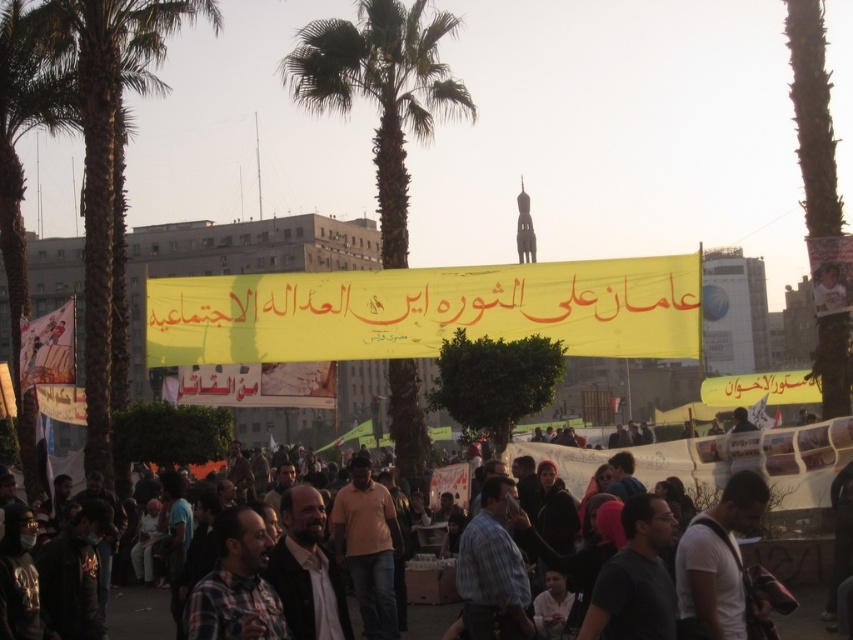
You are a photographer at the protest and want to capture both the plaid fabric shirt at center and the orange matte shirt at center in a single shot. Can you focus on both clearly if your camera can only focus on one depth layer?

The plaid fabric shirt at center is positioned over the orange matte shirt at center, so they are at different depths. The camera can only focus on one depth layer, so you cannot focus both clearly.

Based on the photo, what is located at the point with coordinates (x=427, y=310) in the image?

The point with coordinates (x=427, y=310) is on yellow yellowish paper at center.